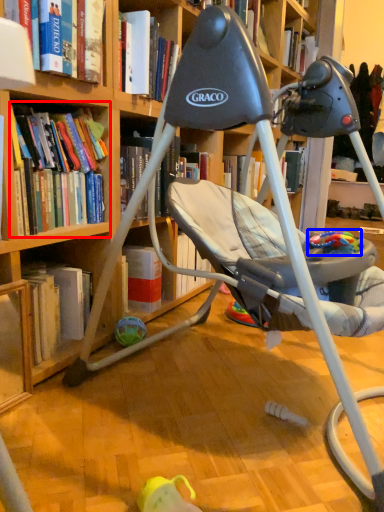
Question: Among these objects, which one is farthest to the camera, book (highlighted by a red box) or toy (highlighted by a blue box)?

Choices:
 (A) book
 (B) toy

Answer: (B)